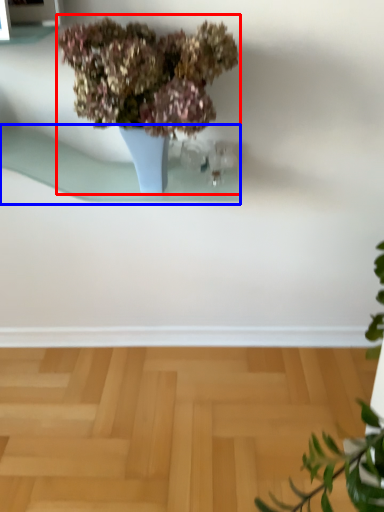
Question: Which object appears closest to the camera in this image, houseplant (highlighted by a red box) or window sill (highlighted by a blue box)?

Choices:
 (A) houseplant
 (B) window sill

Answer: (A)